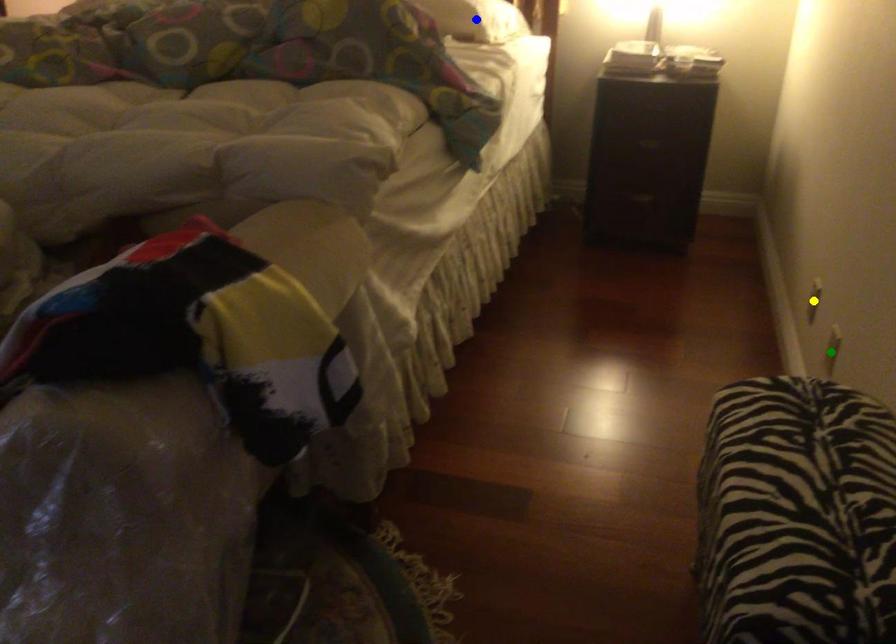
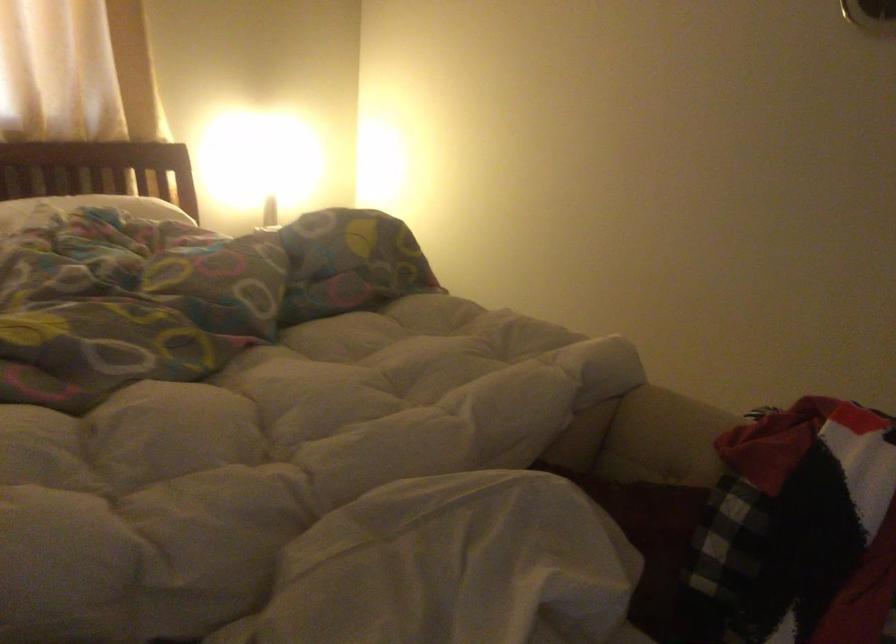
I am providing you with two images of the same scene from different viewpoints. Three points are marked in image1. Which point corresponds to a part or object that is occluded in image2?In image1, three points are marked. Which of them correspond to a part or object that is occluded in image2?Among the three points shown in image1, which one corresponds to a part or object that is no longer visible due to occlusion in image2?

Invisible in image2: yellow point, blue point, green point.